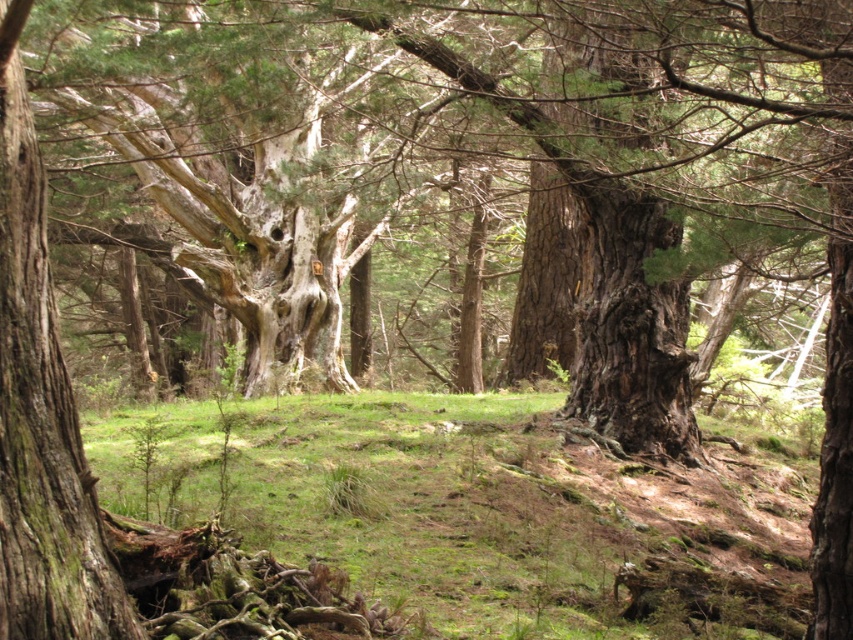
You are a hiker who wants to step onto the green mossy ground at center. Which direction should you move relative to the smooth bark tree trunk at center?

The green mossy ground at center is positioned on the right side of the smooth bark tree trunk at center, so you should move to the right relative to the smooth bark tree trunk at center to step onto the green mossy ground at center.

You are a hiker navigating through the forest and want to step onto the green mossy ground at center from the smooth bark tree trunk at center. Which direction should you move to reach it?

You should move forward towards the green mossy ground at center because it is closer to you than the smooth bark tree trunk at center.